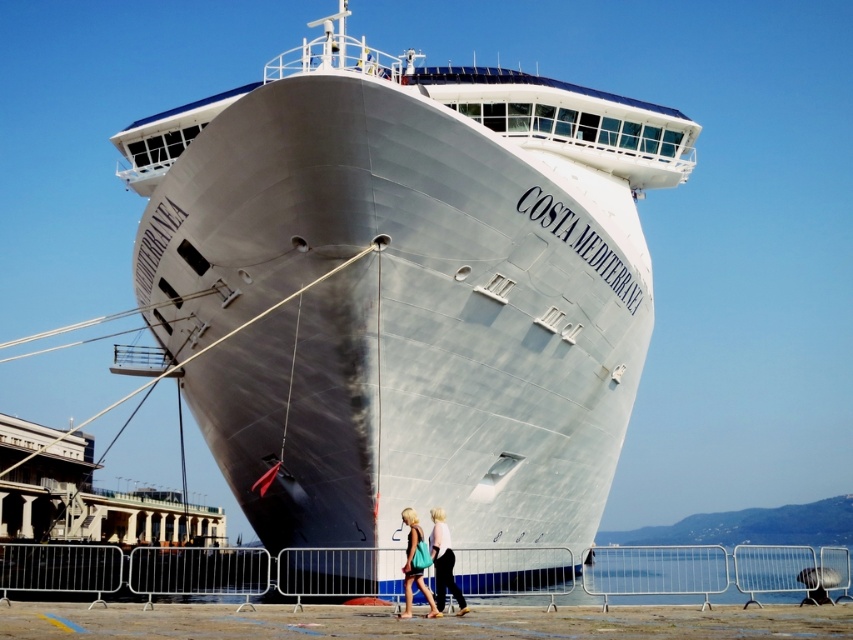
You are standing on the dock and looking at the polished steel ship at center and the matte blue dress at center. Which object is taller?

The polished steel ship at center is much taller than the matte blue dress at center.

You are standing on the dock and want to walk from the polished steel ship at center to the matte blue dress at center. How many steps would you need to take if each step covers approximately 2.5 feet?

The distance between the polished steel ship at center and the matte blue dress at center is 74.94 feet. Dividing this by 2.5 feet per step gives approximately 29.98 steps, so you would need to take around 30 steps to reach the matte blue dress at center from the polished steel ship at center.

You are standing on the dock and want to board the polished steel ship at center. Based on its position, which direction should you head towards from your current location?

The polished steel ship at center is located at point coordinates, so you should head towards the center of the dock to reach it.